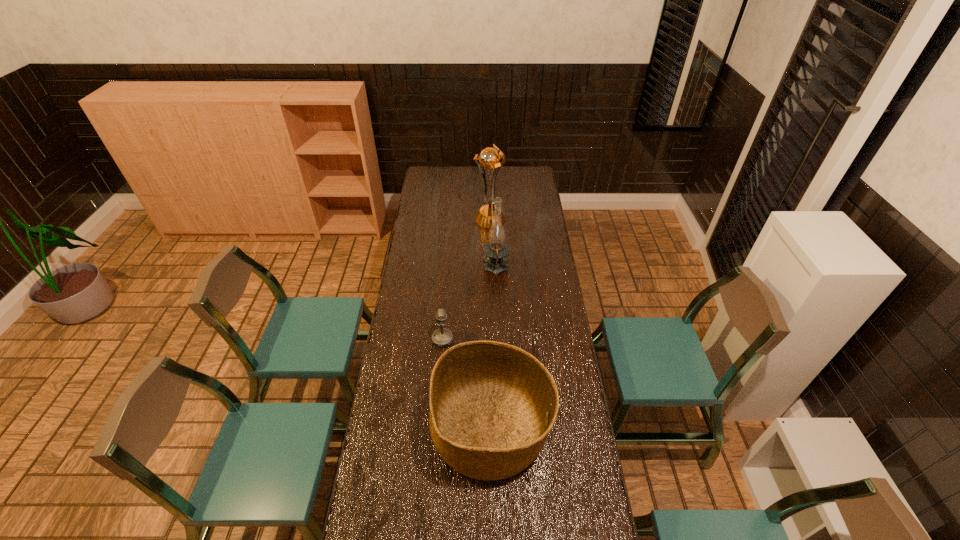
Identify the location of the farthest object. (489, 158).

Image resolution: width=960 pixels, height=540 pixels. Find the location of `oil lamp`. oil lamp is located at coordinates (496, 250).

The image size is (960, 540). Identify the location of basket. [492, 405].

Where is `the nearest object`? The width and height of the screenshot is (960, 540). the nearest object is located at coordinates (492, 405).

Where is `the third farthest object`? the third farthest object is located at coordinates pos(443,337).

The width and height of the screenshot is (960, 540). Identify the location of the shortest object. (443, 337).

Find the location of a particular element. Image resolution: width=960 pixels, height=540 pixels. vacant point located 0.190m on the front-facing side of the farthest object is located at coordinates (491, 251).

Locate an element on the screen. Image resolution: width=960 pixels, height=540 pixels. vacant space located 0.240m on the back of the oil lamp is located at coordinates (494, 227).

Find the location of a particular element. The width and height of the screenshot is (960, 540). vacant space situated on the back of the nearest object is located at coordinates (489, 318).

Where is `blank space located 0.240m on the front-facing side of the microphone`? blank space located 0.240m on the front-facing side of the microphone is located at coordinates [510, 340].